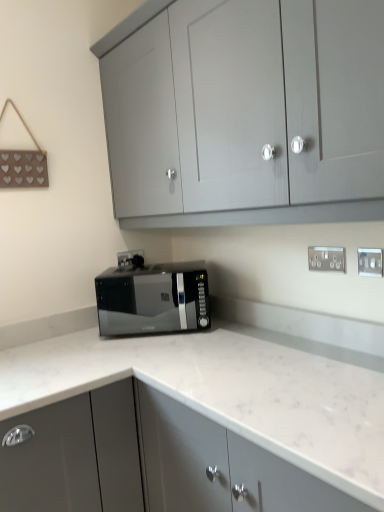
Identify the location of silver metallic electric outlet at center-right, which ranks as the 3th electric outlet in right-to-left order. The height and width of the screenshot is (512, 384). (130, 258).

This screenshot has height=512, width=384. In order to click on white marble countertop at center, acting as the 2th cabinetry starting from the top in this screenshot , I will do `click(146, 460)`.

This screenshot has height=512, width=384. What do you see at coordinates (327, 259) in the screenshot? I see `silver metallic electric outlet at upper right, the second electric outlet when ordered from back to front` at bounding box center [327, 259].

Where is `white plastic electric outlet at upper right, the 1th electric outlet viewed from the front`? The height and width of the screenshot is (512, 384). white plastic electric outlet at upper right, the 1th electric outlet viewed from the front is located at coordinates (370, 262).

Does matte gray cabinet at upper center, the second cabinetry ordered from the bottom, have a greater width compared to black glossy microwave at center?

Yes, matte gray cabinet at upper center, the second cabinetry ordered from the bottom, is wider than black glossy microwave at center.

What's the angular difference between matte gray cabinet at upper center, the second cabinetry ordered from the bottom, and black glossy microwave at center's facing directions?

matte gray cabinet at upper center, the second cabinetry ordered from the bottom, and black glossy microwave at center are facing 52.8 degrees away from each other.

At what (x,y) coordinates should I click in order to perform the action: click on microwave oven that appears on the left of matte gray cabinet at upper center, the second cabinetry ordered from the bottom. Please return your answer as a coordinate pair (x, y). The height and width of the screenshot is (512, 384). Looking at the image, I should click on [x=153, y=298].

Between point (382, 147) and point (162, 285), which one is positioned behind?

Point (162, 285)

Is black glossy microwave at center next to white plastic electric outlet at upper right, the first electric outlet in the right-to-left sequence, and touching it?

No.

From the image's perspective, is black glossy microwave at center under white plastic electric outlet at upper right, the 1th electric outlet viewed from the front?

Yes.

From a real-world perspective, which object stands above the other?

white plastic electric outlet at upper right, the 1th electric outlet viewed from the front, is physically above.

Consider the image. Does black glossy microwave at center have a larger size compared to white plastic electric outlet at upper right, the 3th electric outlet from the left?

Yes.

Which of these two, white plastic electric outlet at upper right, the first electric outlet in the right-to-left sequence, or silver metallic electric outlet at upper right, the 2th electric outlet positioned from the left, stands taller?

white plastic electric outlet at upper right, the first electric outlet in the right-to-left sequence.

Is the position of white plastic electric outlet at upper right, the 1th electric outlet viewed from the front, less distant than that of silver metallic electric outlet at upper right, the 2th electric outlet positioned from the left?

Yes, white plastic electric outlet at upper right, the 1th electric outlet viewed from the front, is closer to the camera.

The image size is (384, 512). I want to click on the 1st electric outlet behind the white plastic electric outlet at upper right, the first electric outlet in the right-to-left sequence, counting from the anchor's position, so click(327, 259).

Considering the relative sizes of white plastic electric outlet at upper right, the 1th electric outlet viewed from the front, and silver metallic electric outlet at upper right, the second electric outlet when ordered from back to front, in the image provided, is white plastic electric outlet at upper right, the 1th electric outlet viewed from the front, smaller than silver metallic electric outlet at upper right, the second electric outlet when ordered from back to front,?

Yes.

Is silver metallic electric outlet at upper right, which ranks as the 2th electric outlet in right-to-left order, turned away from white plastic electric outlet at upper right, the 3th electric outlet from the left?

No, white plastic electric outlet at upper right, the 3th electric outlet from the left, is not at the back of silver metallic electric outlet at upper right, which ranks as the 2th electric outlet in right-to-left order.

Is silver metallic electric outlet at upper right, which ranks as the 2th electric outlet in right-to-left order, not close to white plastic electric outlet at upper right, the 1th electric outlet viewed from the front?

That's not correct — silver metallic electric outlet at upper right, which ranks as the 2th electric outlet in right-to-left order, is a little close to white plastic electric outlet at upper right, the 1th electric outlet viewed from the front.

Considering the relative positions of silver metallic electric outlet at upper right, which ranks as the 2th electric outlet in right-to-left order, and white plastic electric outlet at upper right, marked as the 3th electric outlet in a back-to-front arrangement, in the image provided, is silver metallic electric outlet at upper right, which ranks as the 2th electric outlet in right-to-left order, to the left of white plastic electric outlet at upper right, marked as the 3th electric outlet in a back-to-front arrangement, from the viewer's perspective?

Yes.

Which is in front, point (315, 264) or point (372, 248)?

The point (372, 248) is in front.

Based on the photo, who is bigger, matte gray cabinet at upper center, which ranks as the 1th cabinetry in top-to-bottom order, or white marble countertop at center, acting as the 2th cabinetry starting from the top?

white marble countertop at center, acting as the 2th cabinetry starting from the top, is bigger.

Which of these two, matte gray cabinet at upper center, which ranks as the 1th cabinetry in top-to-bottom order, or white marble countertop at center, the 1th cabinetry from the bottom, stands shorter?

matte gray cabinet at upper center, which ranks as the 1th cabinetry in top-to-bottom order, is shorter.

Are matte gray cabinet at upper center, the second cabinetry ordered from the bottom, and white marble countertop at center, acting as the 2th cabinetry starting from the top, located far from each other?

matte gray cabinet at upper center, the second cabinetry ordered from the bottom, is actually quite close to white marble countertop at center, acting as the 2th cabinetry starting from the top.

From a real-world perspective, is silver metallic electric outlet at upper right, which ranks as the 2th electric outlet in right-to-left order, on top of black glossy microwave at center?

Yes, from a real-world perspective, silver metallic electric outlet at upper right, which ranks as the 2th electric outlet in right-to-left order, is on top of black glossy microwave at center.

From the image's perspective, is silver metallic electric outlet at upper right, which ranks as the 2th electric outlet in right-to-left order, positioned above or below black glossy microwave at center?

silver metallic electric outlet at upper right, which ranks as the 2th electric outlet in right-to-left order, is above black glossy microwave at center.

Are silver metallic electric outlet at upper right, the second electric outlet when ordered from back to front, and black glossy microwave at center beside each other?

They are not placed beside each other.

Is silver metallic electric outlet at upper right, the 2th electric outlet positioned from the left, not within black glossy microwave at center?

Indeed, silver metallic electric outlet at upper right, the 2th electric outlet positioned from the left, is completely outside black glossy microwave at center.

The height and width of the screenshot is (512, 384). Identify the location of electric outlet on the left side of black glossy microwave at center. (130, 258).

Is black glossy microwave at center positioned with its back to silver metallic electric outlet at center-right, which ranks as the 3th electric outlet in right-to-left order?

Yes, silver metallic electric outlet at center-right, which ranks as the 3th electric outlet in right-to-left order, is at the back of black glossy microwave at center.

Considering the relative sizes of black glossy microwave at center and silver metallic electric outlet at center-right, the 1th electric outlet when ordered from back to front, in the image provided, is black glossy microwave at center smaller than silver metallic electric outlet at center-right, the 1th electric outlet when ordered from back to front,?

No.

Considering the relative sizes of black glossy microwave at center and silver metallic electric outlet at center-right, which ranks as the 3th electric outlet in right-to-left order, in the image provided, is black glossy microwave at center wider than silver metallic electric outlet at center-right, which ranks as the 3th electric outlet in right-to-left order,?

Correct, the width of black glossy microwave at center exceeds that of silver metallic electric outlet at center-right, which ranks as the 3th electric outlet in right-to-left order.

Identify the location of microwave oven behind the matte gray cabinet at upper center, the second cabinetry ordered from the bottom. (153, 298).

The height and width of the screenshot is (512, 384). Find the location of `microwave oven below the white plastic electric outlet at upper right, marked as the 3th electric outlet in a back-to-front arrangement (from the image's perspective)`. microwave oven below the white plastic electric outlet at upper right, marked as the 3th electric outlet in a back-to-front arrangement (from the image's perspective) is located at coordinates (153, 298).

Based on their spatial positions, is white plastic electric outlet at upper right, the first electric outlet in the right-to-left sequence, or white marble countertop at center, acting as the 2th cabinetry starting from the top, closer to matte gray cabinet at upper center, the second cabinetry ordered from the bottom?

Among the two, white plastic electric outlet at upper right, the first electric outlet in the right-to-left sequence, is located nearer to matte gray cabinet at upper center, the second cabinetry ordered from the bottom.

When comparing their distances from white plastic electric outlet at upper right, marked as the 3th electric outlet in a back-to-front arrangement, does black glossy microwave at center or silver metallic electric outlet at center-right, which ranks as the 3th electric outlet in right-to-left order, seem further?

The object further to white plastic electric outlet at upper right, marked as the 3th electric outlet in a back-to-front arrangement, is silver metallic electric outlet at center-right, which ranks as the 3th electric outlet in right-to-left order.

Based on their spatial positions, is white plastic electric outlet at upper right, the 3th electric outlet from the left, or silver metallic electric outlet at center-right, the 1th electric outlet when ordered from back to front, closer to white marble countertop at center, acting as the 2th cabinetry starting from the top?

white plastic electric outlet at upper right, the 3th electric outlet from the left, is positioned closer to the anchor white marble countertop at center, acting as the 2th cabinetry starting from the top.

Considering their positions, is black glossy microwave at center positioned closer to silver metallic electric outlet at upper right, the 2th electric outlet positioned from the left, than silver metallic electric outlet at center-right, which appears as the third electric outlet when viewed from the front?

The object closer to silver metallic electric outlet at upper right, the 2th electric outlet positioned from the left, is black glossy microwave at center.

From the image, which object appears to be nearer to white plastic electric outlet at upper right, the 1th electric outlet viewed from the front, black glossy microwave at center or matte gray cabinet at upper center, which ranks as the 1th cabinetry in top-to-bottom order?

Among the two, matte gray cabinet at upper center, which ranks as the 1th cabinetry in top-to-bottom order, is located nearer to white plastic electric outlet at upper right, the 1th electric outlet viewed from the front.

Considering their positions, is white marble countertop at center, the 1th cabinetry from the bottom, positioned further to silver metallic electric outlet at upper right, the 2th electric outlet positioned from the left, than white plastic electric outlet at upper right, marked as the 3th electric outlet in a back-to-front arrangement?

white marble countertop at center, the 1th cabinetry from the bottom, is further to silver metallic electric outlet at upper right, the 2th electric outlet positioned from the left.

From the image, which object appears to be nearer to matte gray cabinet at upper center, the second cabinetry ordered from the bottom, black glossy microwave at center or silver metallic electric outlet at upper right, acting as the second electric outlet starting from the front?

black glossy microwave at center.

From the image, which object appears to be farther from black glossy microwave at center, silver metallic electric outlet at upper right, the second electric outlet when ordered from back to front, or matte gray cabinet at upper center, which ranks as the 1th cabinetry in top-to-bottom order?

silver metallic electric outlet at upper right, the second electric outlet when ordered from back to front, is further to black glossy microwave at center.

I want to click on microwave oven between silver metallic electric outlet at center-right, positioned as the first electric outlet in left-to-right order, and silver metallic electric outlet at upper right, the 2th electric outlet positioned from the left, so click(153, 298).

Locate an element on the screen. This screenshot has height=512, width=384. microwave oven between white marble countertop at center, the 1th cabinetry from the bottom, and silver metallic electric outlet at center-right, the 1th electric outlet when ordered from back to front, from front to back is located at coordinates (153, 298).

Where is `microwave oven located between silver metallic electric outlet at center-right, the 1th electric outlet when ordered from back to front, and white plastic electric outlet at upper right, the first electric outlet in the right-to-left sequence, in the left-right direction`? Image resolution: width=384 pixels, height=512 pixels. microwave oven located between silver metallic electric outlet at center-right, the 1th electric outlet when ordered from back to front, and white plastic electric outlet at upper right, the first electric outlet in the right-to-left sequence, in the left-right direction is located at coordinates (153, 298).

You are a GUI agent. You are given a task and a screenshot of the screen. Output one action in this format:
    pyautogui.click(x=<x>, y=<y>)
    Task: Click on the microwave oven between matte gray cabinet at upper center, which ranks as the 1th cabinetry in top-to-bottom order, and white marble countertop at center, acting as the 2th cabinetry starting from the top, vertically
    This screenshot has height=512, width=384.
    Given the screenshot: What is the action you would take?
    pyautogui.click(x=153, y=298)